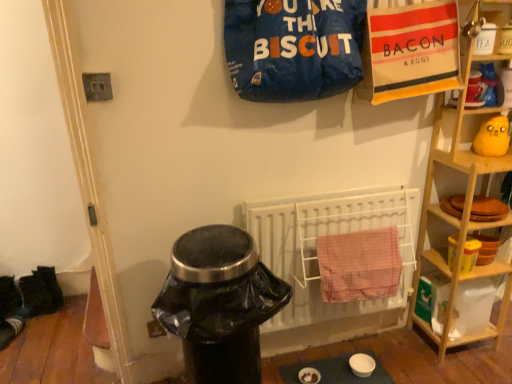
Where is `vacant area situated below matte blue table at lower center (from a real-world perspective)`? vacant area situated below matte blue table at lower center (from a real-world perspective) is located at coordinates (330, 370).